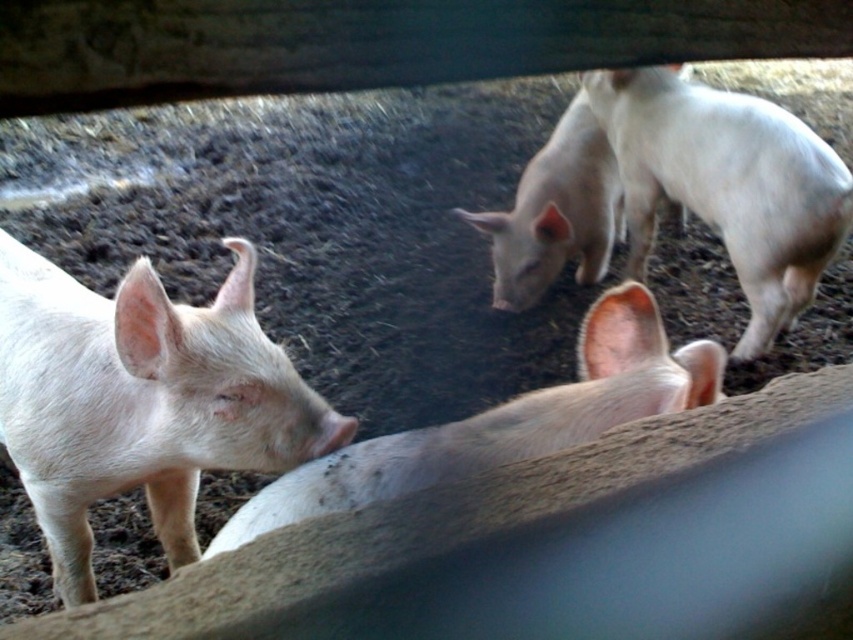
Does white matte pig at upper right lie in front of white matte pig at center?

Yes, white matte pig at upper right is in front of white matte pig at center.

From the picture: Which is above, white matte pig at upper right or white matte pig at center?

white matte pig at center is above.

In order to click on white matte pig at upper right in this screenshot , I will do `click(727, 184)`.

Based on the photo, can you confirm if white matte pig at left is positioned to the left of white matte pig at center?

Correct, you'll find white matte pig at left to the left of white matte pig at center.

Describe the element at coordinates (141, 401) in the screenshot. I see `white matte pig at left` at that location.

Find the location of a particular element. Image resolution: width=853 pixels, height=640 pixels. white matte pig at left is located at coordinates tap(141, 401).

Does white matte pig at upper right appear on the left side of matte pink piglet at center?

No, white matte pig at upper right is not to the left of matte pink piglet at center.

Between white matte pig at upper right and matte pink piglet at center, which one has more height?

white matte pig at upper right is taller.

Does point (836, 220) come closer to viewer compared to point (613, 362)?

No, it is behind (613, 362).

Locate an element on the screen. The image size is (853, 640). white matte pig at upper right is located at coordinates (727, 184).